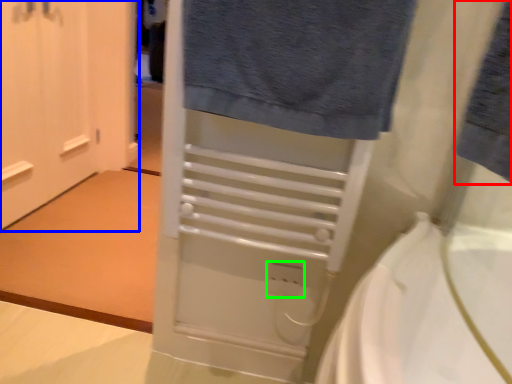
Question: Which object is the closest to the bath towel (highlighted by a red box)? Choose among these: door (highlighted by a blue box) or electric outlet (highlighted by a green box).

Choices:
 (A) door
 (B) electric outlet

Answer: (B)